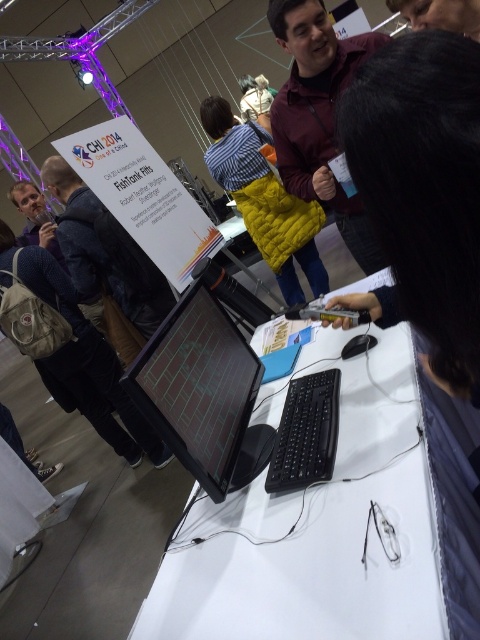
Does maroon quilted jacket at upper center appear on the right side of yellow quilted jacket at center?

Correct, you'll find maroon quilted jacket at upper center to the right of yellow quilted jacket at center.

Does point (357, 198) come closer to viewer compared to point (222, 116)?

Yes, point (357, 198) is in front of point (222, 116).

Does point (330, 156) come farther from viewer compared to point (264, 216)?

No, (330, 156) is closer to viewer.

You are a GUI agent. You are given a task and a screenshot of the screen. Output one action in this format:
    pyautogui.click(x=<x>, y=<y>)
    Task: Click on the maroon quilted jacket at upper center
    
    Given the screenshot: What is the action you would take?
    pyautogui.click(x=319, y=115)

Who is lower down, matte black backpack at lower left or black plastic keyboard at lower center?

Positioned lower is black plastic keyboard at lower center.

Is matte black backpack at lower left positioned in front of black plastic keyboard at lower center?

No, it is not.

Between point (168, 456) and point (317, 422), which one is positioned behind?

Positioned behind is point (168, 456).

You are a GUI agent. You are given a task and a screenshot of the screen. Output one action in this format:
    pyautogui.click(x=<x>, y=<y>)
    Task: Click on the matte black backpack at lower left
    
    Given the screenshot: What is the action you would take?
    pyautogui.click(x=84, y=358)

Can you confirm if white glossy table at center is positioned above matte black laptop at left?

No, white glossy table at center is not above matte black laptop at left.

This screenshot has height=640, width=480. Find the location of `white glossy table at center`. white glossy table at center is located at coordinates (316, 529).